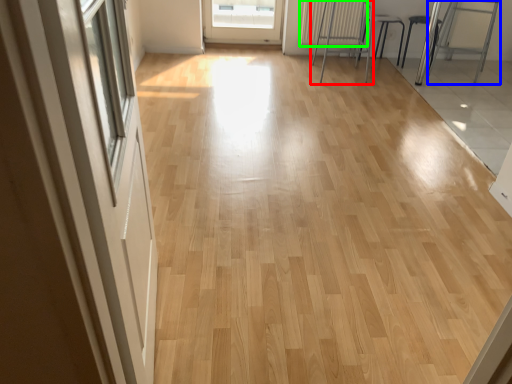
Question: Estimate the real-world distances between objects in this image. Which object is closer to furniture (highlighted by a red box), armchair (highlighted by a blue box) or radiator (highlighted by a green box)?

Choices:
 (A) armchair
 (B) radiator

Answer: (B)